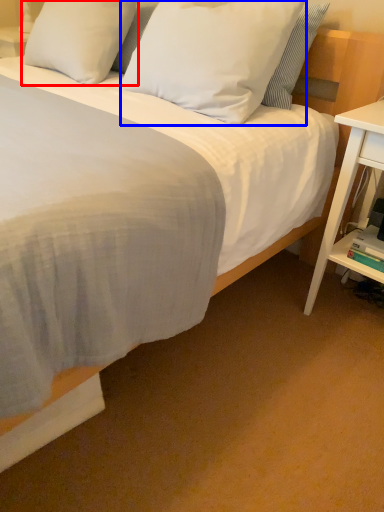
Question: Among these objects, which one is farthest to the camera, pillow (highlighted by a red box) or pillow (highlighted by a blue box)?

Choices:
 (A) pillow
 (B) pillow

Answer: (A)